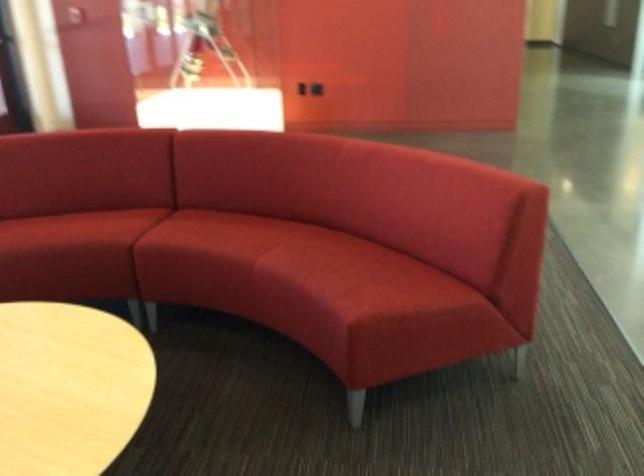
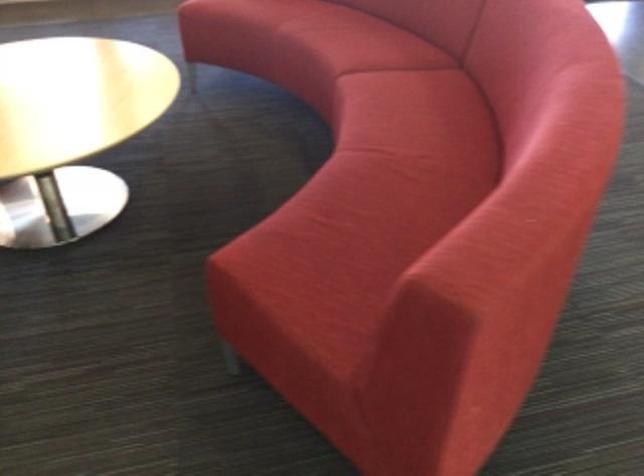
Locate, in the second image, the point that corresponds to (x=272, y=231) in the first image.

(422, 135)